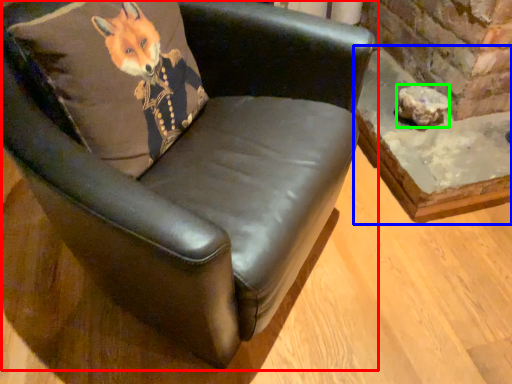
Question: Which object is positioned closest to chair (highlighted by a red box)? Select from table (highlighted by a blue box) and stone (highlighted by a green box).

Choices:
 (A) table
 (B) stone

Answer: (A)